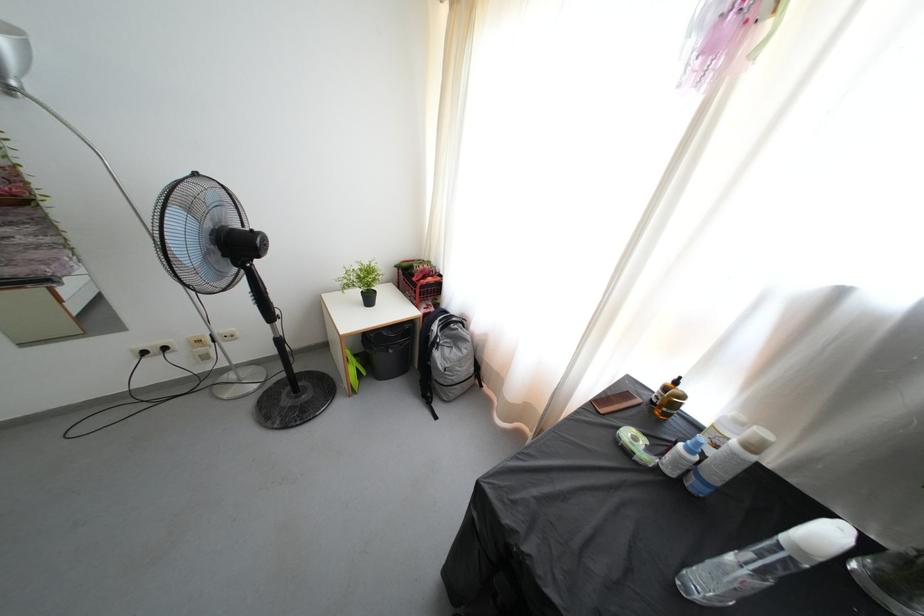
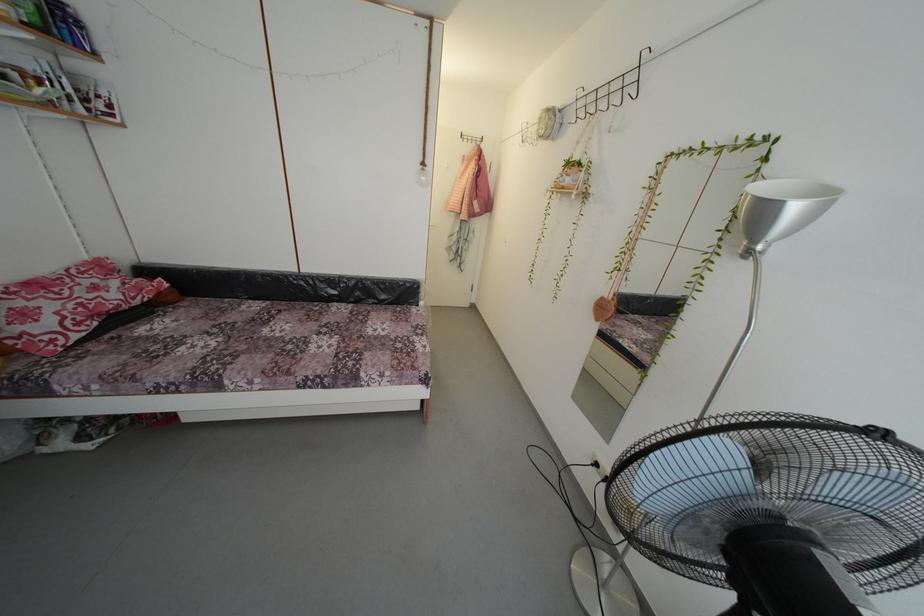
The first image is from the beginning of the video and the second image is from the end. How did the camera likely rotate when shooting the video?

The rotation direction of the camera is left-down.